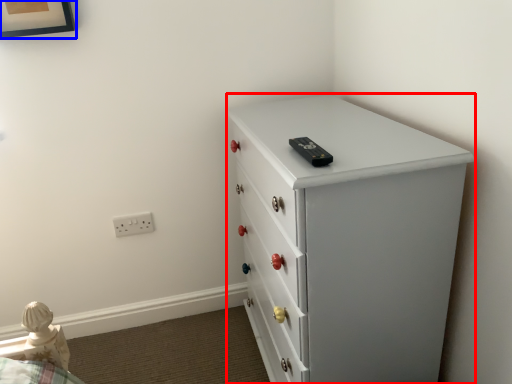
Question: Which point is further to the camera, chest of drawers (highlighted by a red box) or picture frame (highlighted by a blue box)?

Choices:
 (A) chest of drawers
 (B) picture frame

Answer: (B)